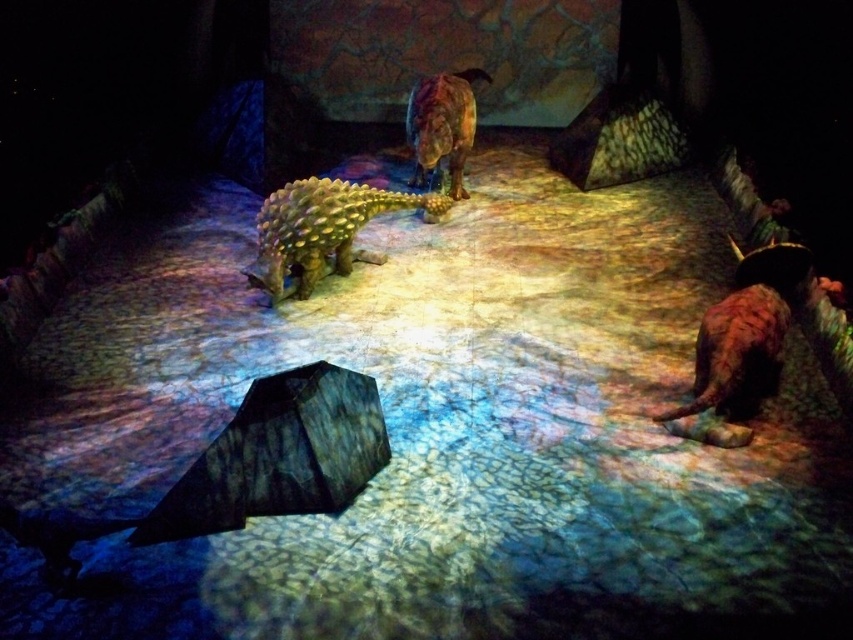
You are a visitor in the museum and want to take a photo of the textured dark gray umbrella at center without the shiny brown dinosaur at center blocking the view. Is there a way to do this?

The textured dark gray umbrella at center is positioned under the shiny brown dinosaur at center, so you can move slightly to the side to avoid the dinosaur blocking the view of the umbrella.

You are standing at the entrance of the museum exhibit and see the textured dark gray umbrella at center. Can you tell me where the point at coordinate (277,456) is located?

The point at coordinate (277,456) is located on the textured dark gray umbrella at center.